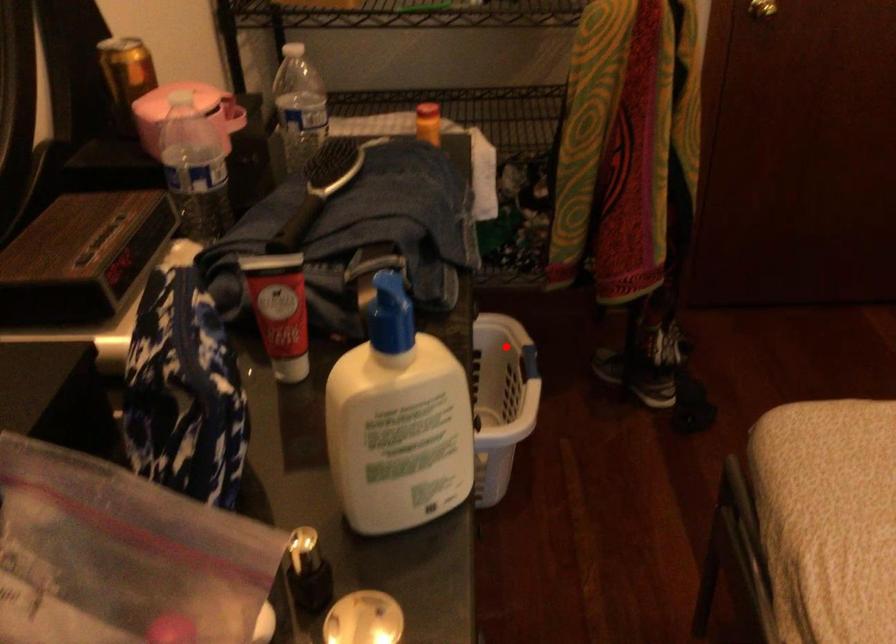
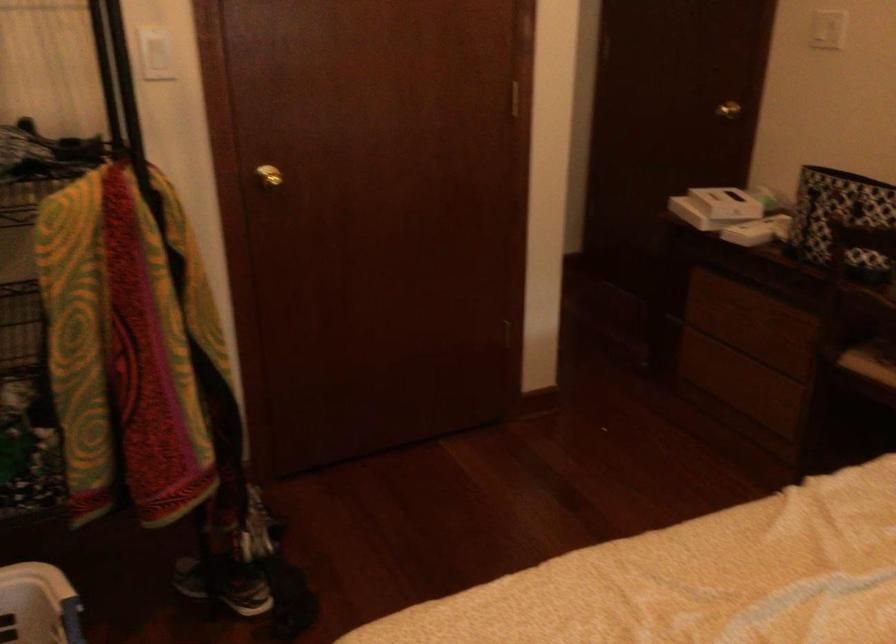
Question: I am providing you with two images of the same scene from different viewpoints. In image1, a red point is highlighted. Considering the same 3D point in image2, which of the following is correct?

Choices:
 (A) It is closer
 (B) It is farther

Answer: (A)